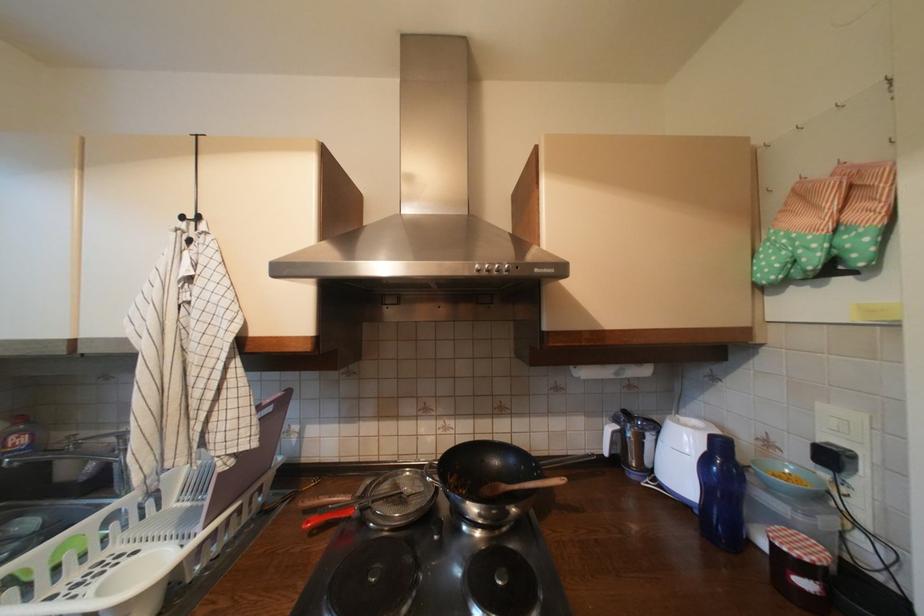
Identify the location of wok handle. (565, 461).